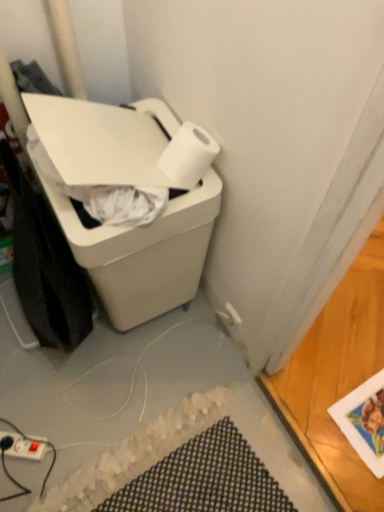
In order to click on free point below black textured bath mat at lower center (from a real-world perspective) in this screenshot , I will do `click(179, 472)`.